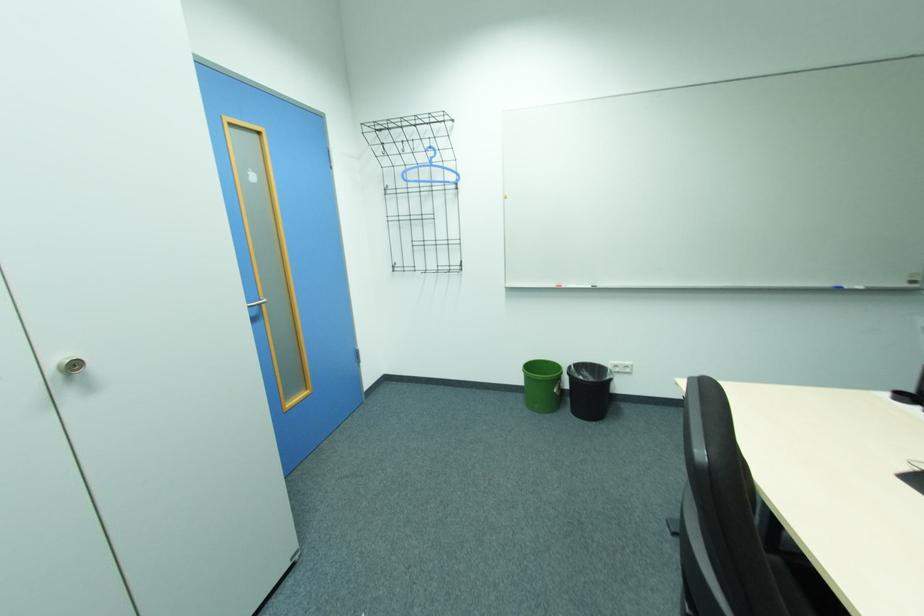
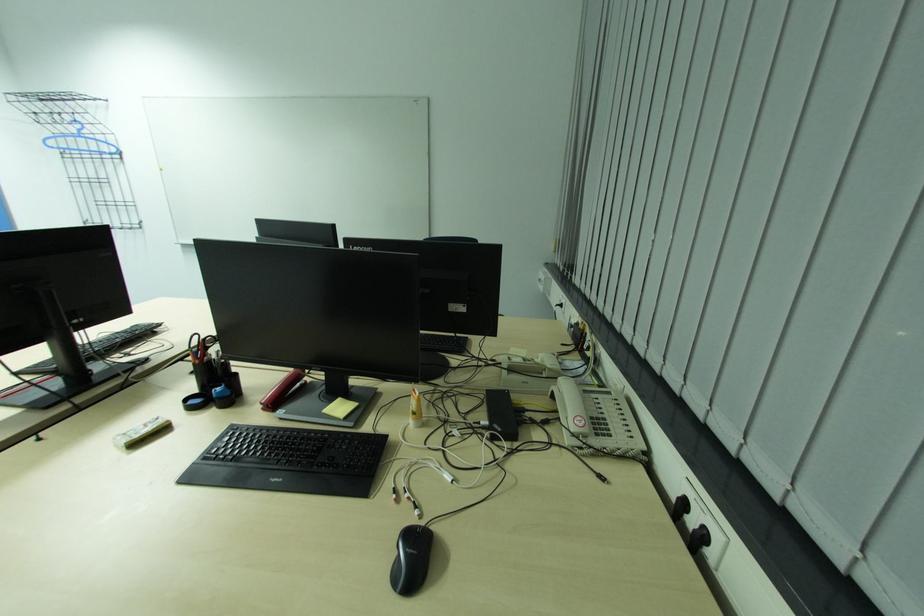
The images are taken continuously from a first-person perspective. In which direction are you moving?

The cameraman walked toward right, backward.